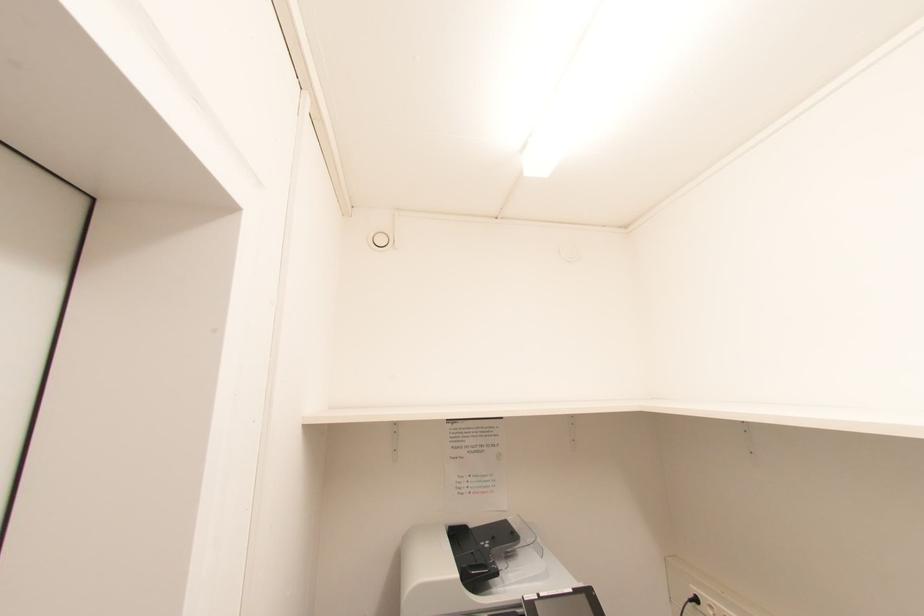
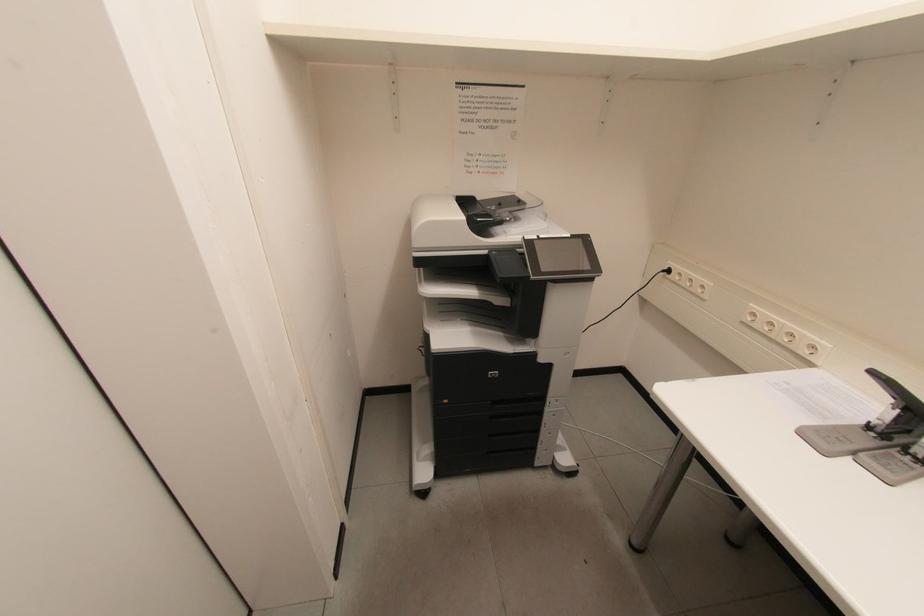
Question: How did the camera likely rotate?

Choices:
 (A) Left
 (B) Right
 (C) Up
 (D) Down

Answer: (D)